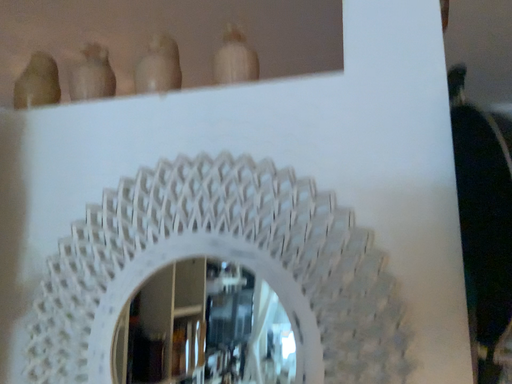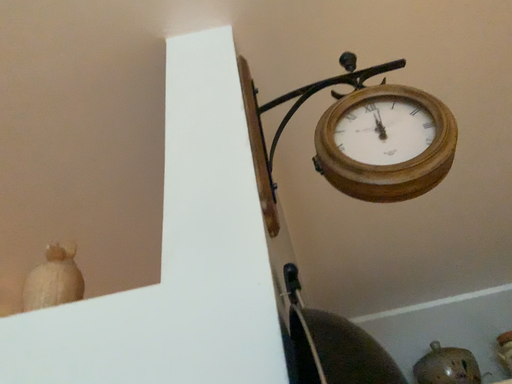
Question: Which way did the camera rotate in the video?

Choices:
 (A) rotated downward
 (B) rotated upward

Answer: (B)